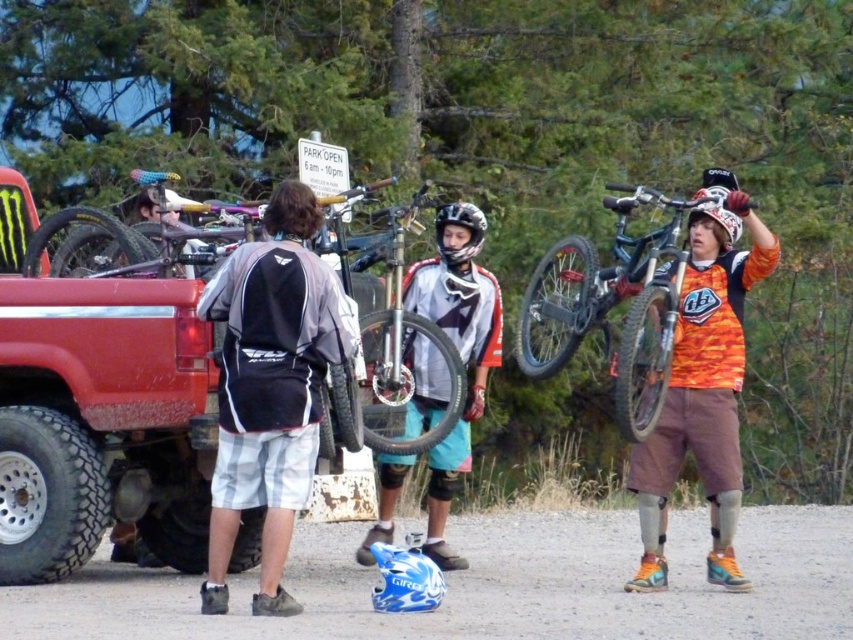
Does shiny metallic bicycle at upper right have a lesser height compared to matte black helmet at center?

Incorrect, shiny metallic bicycle at upper right's height does not fall short of matte black helmet at center's.

Consider the image. Who is positioned more to the right, shiny metallic bicycle at upper right or matte black helmet at center?

shiny metallic bicycle at upper right

Is point (653, 364) positioned in front of point (469, 220)?

Yes, it is in front of point (469, 220).

Locate an element on the screen. The image size is (853, 640). shiny metallic bicycle at upper right is located at coordinates (608, 307).

Is matte white jersey at center in front of brown hair at center?

No, it is behind brown hair at center.

Which is behind, point (438, 278) or point (299, 216)?

The point (438, 278) is more distant.

Find the location of `matte white jersey at center`. matte white jersey at center is located at coordinates (457, 349).

Is matte white jersey at center positioned behind matte black helmet at center?

No, matte white jersey at center is in front of matte black helmet at center.

Between point (480, 308) and point (440, 221), which one is positioned in front?

Point (440, 221) is in front.

At what (x,y) coordinates should I click in order to perform the action: click on matte white jersey at center. Please return your answer as a coordinate pair (x, y). Looking at the image, I should click on (457, 349).